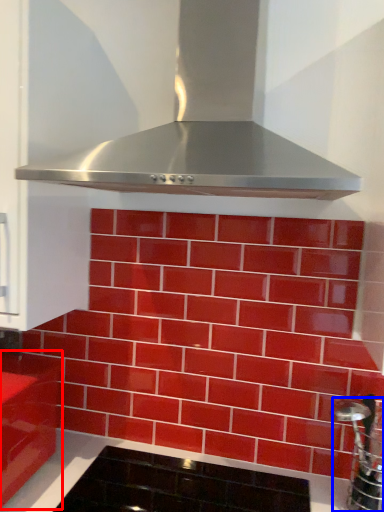
Question: Which point is closer to the camera, cabinetry (highlighted by a red box) or stainless steel (highlighted by a blue box)?

Choices:
 (A) cabinetry
 (B) stainless steel

Answer: (B)